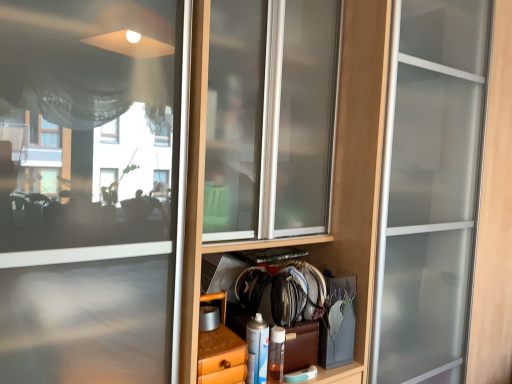
Describe the element at coordinates (221, 351) in the screenshot. The image size is (512, 384). I see `wooden drawer at lower center` at that location.

In order to click on wooden drawer at lower center in this screenshot , I will do `click(221, 351)`.

In order to face translucent plastic spray can at lower center, should I rotate leftwards or rightwards?

You should rotate right by 0.666 degrees.

The width and height of the screenshot is (512, 384). What do you see at coordinates (257, 350) in the screenshot?
I see `translucent plastic spray can at lower center` at bounding box center [257, 350].

In order to click on translucent plastic spray can at lower center in this screenshot , I will do click(257, 350).

Locate an element on the screen. This screenshot has width=512, height=384. wooden drawer at lower center is located at coordinates pyautogui.click(x=221, y=351).

Which is more to the right, translucent plastic spray can at lower center or wooden drawer at lower center?

From the viewer's perspective, translucent plastic spray can at lower center appears more on the right side.

Considering the relative positions of translucent plastic spray can at lower center and wooden drawer at lower center in the image provided, is translucent plastic spray can at lower center in front of wooden drawer at lower center?

No, translucent plastic spray can at lower center is further to the viewer.

Is point (261, 315) positioned after point (225, 316)?

That is False.

From the image's perspective, would you say translucent plastic spray can at lower center is positioned over wooden drawer at lower center?

No, from the image's perspective, translucent plastic spray can at lower center is not on top of wooden drawer at lower center.

From a real-world perspective, which object stands above the other?

From a 3D spatial view, wooden drawer at lower center is above.

Is translucent plastic spray can at lower center wider or thinner than wooden drawer at lower center?

translucent plastic spray can at lower center is thinner than wooden drawer at lower center.

Considering the relative sizes of translucent plastic spray can at lower center and wooden drawer at lower center in the image provided, is translucent plastic spray can at lower center shorter than wooden drawer at lower center?

Yes, translucent plastic spray can at lower center is shorter than wooden drawer at lower center.

Considering the sizes of objects translucent plastic spray can at lower center and wooden drawer at lower center in the image provided, who is smaller, translucent plastic spray can at lower center or wooden drawer at lower center?

translucent plastic spray can at lower center is smaller.

Looking at this image, is translucent plastic spray can at lower center not within wooden drawer at lower center?

Yes, translucent plastic spray can at lower center is not within wooden drawer at lower center.

Is translucent plastic spray can at lower center far from wooden drawer at lower center?

No, translucent plastic spray can at lower center is not far from wooden drawer at lower center.

Is translucent plastic spray can at lower center looking in the opposite direction of wooden drawer at lower center?

translucent plastic spray can at lower center is not turned away from wooden drawer at lower center.

How much distance is there between translucent plastic spray can at lower center and wooden drawer at lower center?

They are 7.53 centimeters apart.

What are the coordinates of `bottle behind the wooden drawer at lower center` in the screenshot? It's located at (x=257, y=350).

Considering the relative positions of wooden drawer at lower center and translucent plastic spray can at lower center in the image provided, is wooden drawer at lower center to the left of translucent plastic spray can at lower center from the viewer's perspective?

Indeed, wooden drawer at lower center is positioned on the left side of translucent plastic spray can at lower center.

Is wooden drawer at lower center in front of or behind translucent plastic spray can at lower center in the image?

Visually, wooden drawer at lower center is located in front of translucent plastic spray can at lower center.

Is point (227, 334) positioned behind point (251, 378)?

No, it is in front of (251, 378).

From the picture: From the image's perspective, is wooden drawer at lower center positioned above or below translucent plastic spray can at lower center?

Based on their image positions, wooden drawer at lower center is located above translucent plastic spray can at lower center.

From a real-world perspective, which object rests below the other?

From a 3D spatial view, translucent plastic spray can at lower center is below.

Looking at their sizes, would you say wooden drawer at lower center is wider or thinner than translucent plastic spray can at lower center?

Clearly, wooden drawer at lower center has more width compared to translucent plastic spray can at lower center.

Who is shorter, wooden drawer at lower center or translucent plastic spray can at lower center?

translucent plastic spray can at lower center.

Can you confirm if wooden drawer at lower center is bigger than translucent plastic spray can at lower center?

Indeed, wooden drawer at lower center has a larger size compared to translucent plastic spray can at lower center.

Can we say wooden drawer at lower center lies outside translucent plastic spray can at lower center?

wooden drawer at lower center lies outside translucent plastic spray can at lower center's area.

Are wooden drawer at lower center and translucent plastic spray can at lower center beside each other?

Yes, wooden drawer at lower center is next to translucent plastic spray can at lower center.

Could you tell me if wooden drawer at lower center is facing translucent plastic spray can at lower center?

No, wooden drawer at lower center is not aimed at translucent plastic spray can at lower center.

How far apart are wooden drawer at lower center and translucent plastic spray can at lower center?

wooden drawer at lower center is 2.97 inches away from translucent plastic spray can at lower center.

The width and height of the screenshot is (512, 384). There is a translucent plastic spray can at lower center. Identify the location of cabinetry above it (from a real-world perspective). (221, 351).

You are a GUI agent. You are given a task and a screenshot of the screen. Output one action in this format:
    pyautogui.click(x=<x>, y=<y>)
    Task: Click on the cabinetry that is above the translucent plastic spray can at lower center (from the image's perspective)
    The height and width of the screenshot is (384, 512).
    Given the screenshot: What is the action you would take?
    pyautogui.click(x=221, y=351)

Locate an element on the screen. This screenshot has width=512, height=384. bottle located underneath the wooden drawer at lower center (from a real-world perspective) is located at coordinates (257, 350).